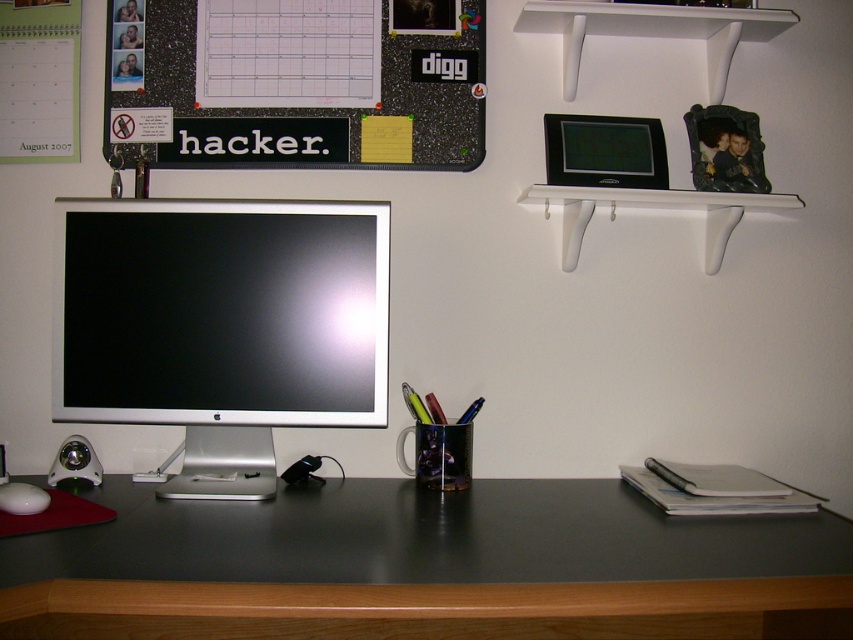
Question: Estimate the real-world distances between objects in this image. Which object is farther from the black matte computer desk at center?

Choices:
 (A) sleek silver monitor at center
 (B) white matte mouse at lower left

Answer: (B)

Question: Does white matte shelf at upper right appear on the right side of white matte mouse at lower left?

Choices:
 (A) yes
 (B) no

Answer: (A)

Question: Does white matte shelf at upper right come in front of white matte mouse at lower left?

Choices:
 (A) no
 (B) yes

Answer: (A)

Question: Which point is closer to the camera taking this photo?

Choices:
 (A) (264, 45)
 (B) (347, 381)
 (C) (102, 568)

Answer: (C)

Question: Is black matte signboard at upper center further to camera compared to white matte mouse at lower left?

Choices:
 (A) yes
 (B) no

Answer: (A)

Question: Which object is closer to the camera taking this photo?

Choices:
 (A) sleek silver monitor at center
 (B) white matte mouse at lower left
 (C) white matte shelf at upper right
 (D) black matte computer desk at center

Answer: (D)